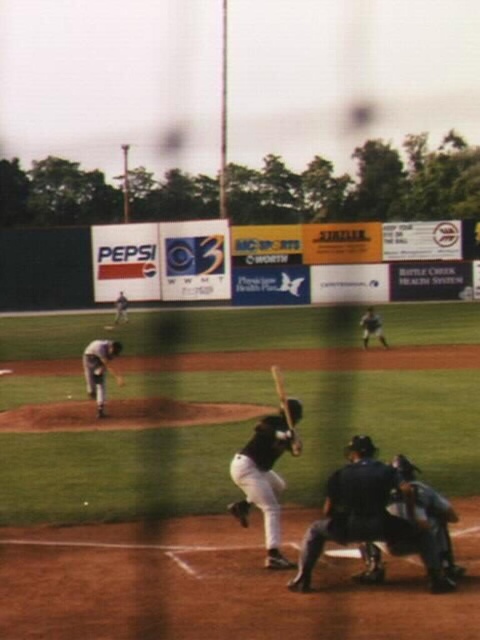
Who is positioned more to the left, gray uniformed man at left or dark blue uniform at right?

Positioned to the left is gray uniformed man at left.

Is gray uniformed man at left taller than dark blue uniform at right?

Incorrect, gray uniformed man at left's height is not larger of dark blue uniform at right's.

What do you see at coordinates (98, 369) in the screenshot? This screenshot has height=640, width=480. I see `gray uniformed man at left` at bounding box center [98, 369].

Find the location of `gray uniformed man at left`. gray uniformed man at left is located at coordinates (98, 369).

Which is more to the left, black matte bat at center or dark blue uniform at right?

black matte bat at center

Does black matte bat at center come behind dark blue uniform at right?

No, black matte bat at center is in front of dark blue uniform at right.

Is point (252, 504) less distant than point (368, 308)?

Yes.

Where is `black matte bat at center`? Image resolution: width=480 pixels, height=640 pixels. black matte bat at center is located at coordinates [265, 476].

You are a GUI agent. You are given a task and a screenshot of the screen. Output one action in this format:
    pyautogui.click(x=<x>, y=<y>)
    Task: Click on the wooden baseball bat at center
    
    Given the screenshot: What is the action you would take?
    pyautogui.click(x=286, y=410)

Does wooden baseball bat at center have a larger size compared to dark blue uniform at upper left?

Actually, wooden baseball bat at center might be smaller than dark blue uniform at upper left.

Does point (287, 413) come farther from viewer compared to point (121, 321)?

No, it is not.

Locate an element on the screen. The image size is (480, 640). wooden baseball bat at center is located at coordinates (286, 410).